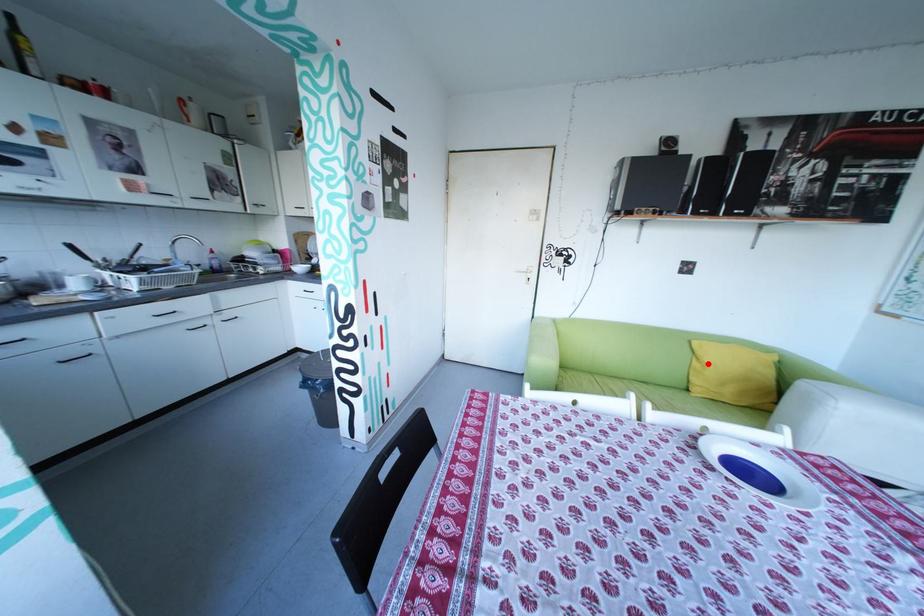
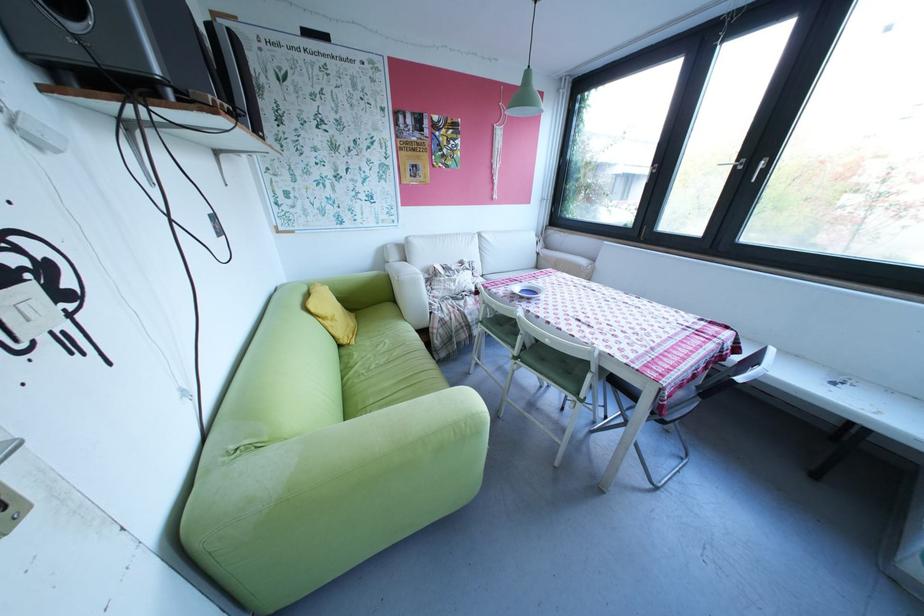
Where in the second image is the point corresponding to the highlighted location from the first image?

(339, 323)